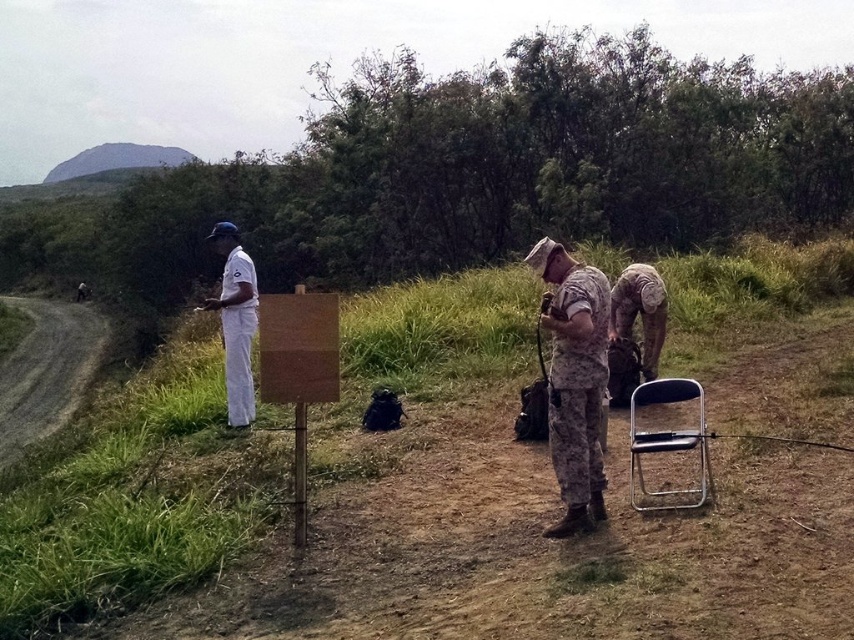
Question: Is metallic silver folding chair at lower right thinner than camouflage fabric backpack at center?

Choices:
 (A) no
 (B) yes

Answer: (A)

Question: Which object is closer to the camera taking this photo?

Choices:
 (A) metallic silver folding chair at lower right
 (B) white uniform at left
 (C) camouflage fabric backpack at center
 (D) brown dirt field at center

Answer: (D)

Question: Among these points, which one is farthest from the camera?

Choices:
 (A) (604, 310)
 (B) (659, 323)
 (C) (256, 292)
 (D) (72, 404)

Answer: (D)

Question: Is dirt/gravel path at left above camouflage fabric backpack at center?

Choices:
 (A) yes
 (B) no

Answer: (B)

Question: Considering the relative positions of camouflage fabric uniform at center and camouflage fabric backpack at center in the image provided, where is camouflage fabric uniform at center located with respect to camouflage fabric backpack at center?

Choices:
 (A) left
 (B) right

Answer: (A)

Question: Which point appears closest to the camera in this image?

Choices:
 (A) (591, 403)
 (B) (642, 285)

Answer: (A)